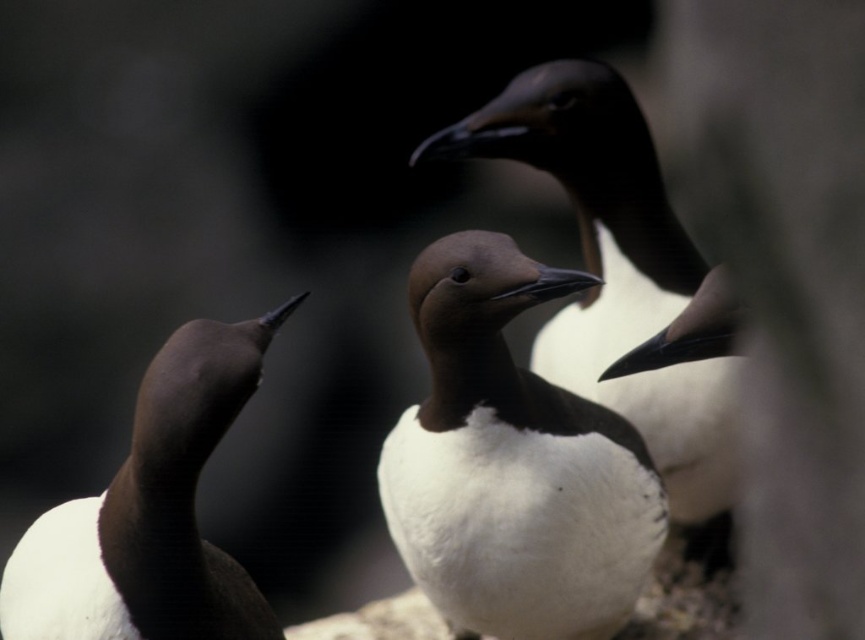
Question: Is white matte penguin at center further to the viewer compared to brown matte bird at center?

Choices:
 (A) yes
 (B) no

Answer: (B)

Question: Which object is the farthest from the brown matte penguin at left?

Choices:
 (A) brown matte bird at center
 (B) white matte penguin at center

Answer: (A)

Question: Which point is farther to the camera?

Choices:
 (A) (39, 554)
 (B) (447, 513)

Answer: (B)

Question: Which is nearer to the white matte penguin at center?

Choices:
 (A) brown matte penguin at left
 (B) brown matte bird at center

Answer: (B)

Question: Can you confirm if white matte penguin at center is positioned to the right of brown matte bird at center?

Choices:
 (A) no
 (B) yes

Answer: (A)

Question: Is white matte penguin at center positioned in front of brown matte penguin at left?

Choices:
 (A) yes
 (B) no

Answer: (B)